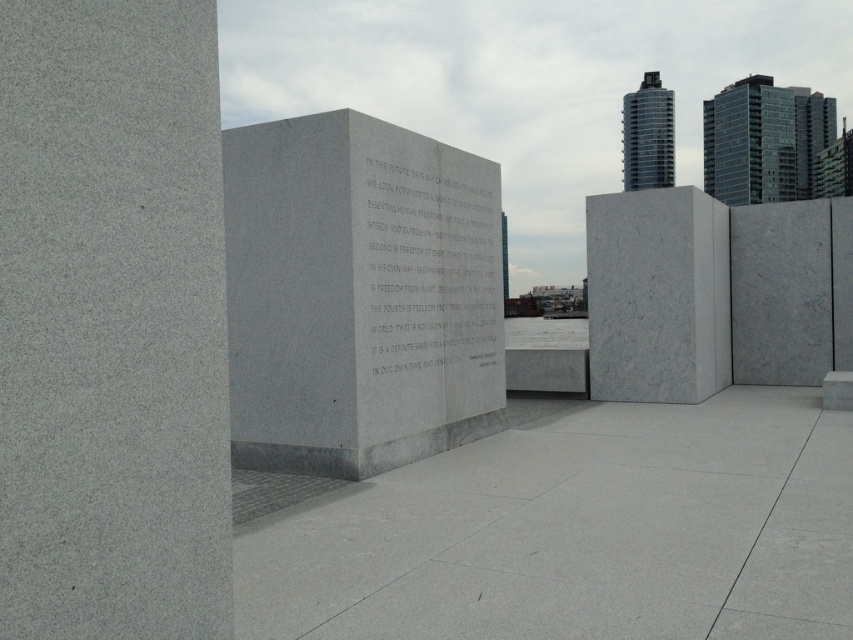
You are standing in the urban landscape and want to place a small flower pot between the white marble stone at center and the white marble pillar at center. According to their positions, which object should the flower pot be closer to?

The white marble stone at center is positioned on the left side of the white marble pillar at center, so the flower pot should be placed between them, closer to the white marble stone at center.

Looking at this image, you are standing at the entrance of the memorial, which is located at the bottom edge of the image. You want to walk directly towards the gray granite pillar at center. Based on the coordinates provided, in which direction should you head relative to your current position?

The gray granite pillar at center is located at coordinates point [112,323]. Since you are at the bottom edge, you should head straight ahead towards the center of the image to reach it.